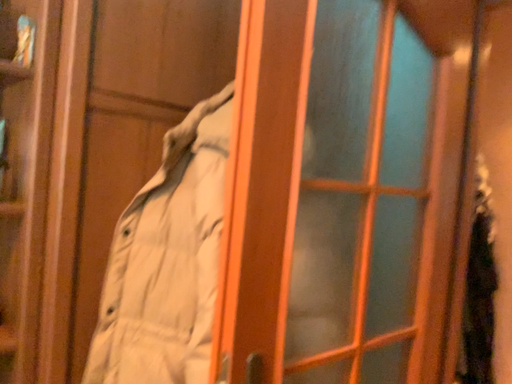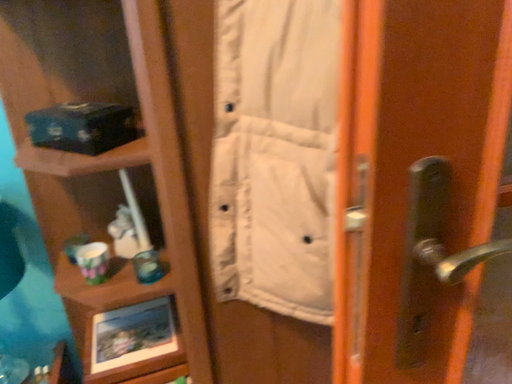
Question: How did the camera likely rotate when shooting the video?

Choices:
 (A) rotated downward
 (B) rotated upward

Answer: (A)